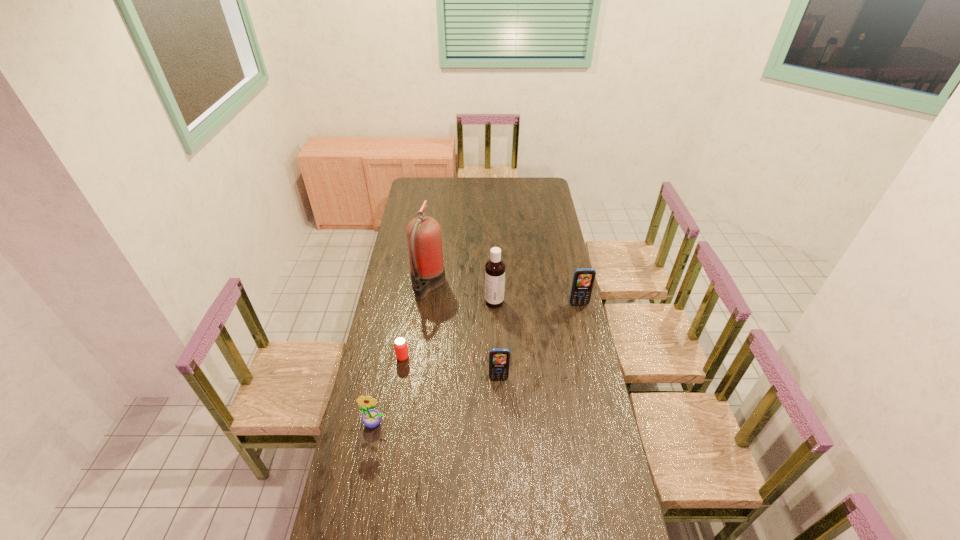
Image resolution: width=960 pixels, height=540 pixels. Find the location of `free space located on the screen of the taller cellular telephone`. free space located on the screen of the taller cellular telephone is located at coordinates (594, 373).

You are a GUI agent. You are given a task and a screenshot of the screen. Output one action in this format:
    pyautogui.click(x=<x>, y=<y>)
    Task: Click on the vacant space situated 0.080m on the label side of the second tallest object
    
    Given the screenshot: What is the action you would take?
    pyautogui.click(x=468, y=302)

Find the location of a particular element. vacant space located on the label side of the second tallest object is located at coordinates (420, 302).

Identify the location of free space located 0.370m on the label side of the second tallest object. The height and width of the screenshot is (540, 960). (407, 302).

The image size is (960, 540). What are the coordinates of `vacant area situated at the nozzle of the fire extinguisher` in the screenshot? It's located at (455, 285).

Locate an element on the screen. This screenshot has width=960, height=540. vacant space located 0.340m on the front-facing side of the nearest object is located at coordinates (354, 534).

Where is `vacant space located 0.070m on the left of the beer can`? This screenshot has height=540, width=960. vacant space located 0.070m on the left of the beer can is located at coordinates (380, 357).

Locate an element on the screen. fire extinguisher that is at the left edge is located at coordinates 424,240.

This screenshot has height=540, width=960. What are the coordinates of `sunflower positioned at the left edge` in the screenshot? It's located at (371, 418).

This screenshot has height=540, width=960. What are the coordinates of `beer can situated at the left edge` in the screenshot? It's located at (400, 344).